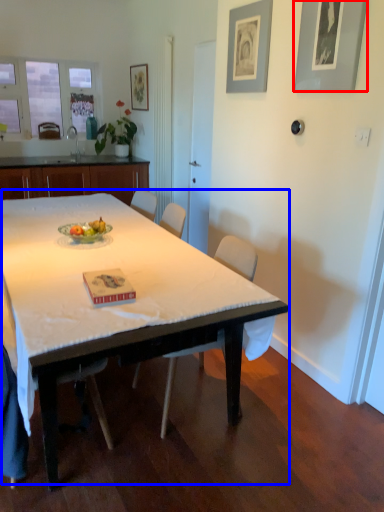
Question: Which point is further to the camera, picture frame (highlighted by a red box) or table (highlighted by a blue box)?

Choices:
 (A) picture frame
 (B) table

Answer: (A)